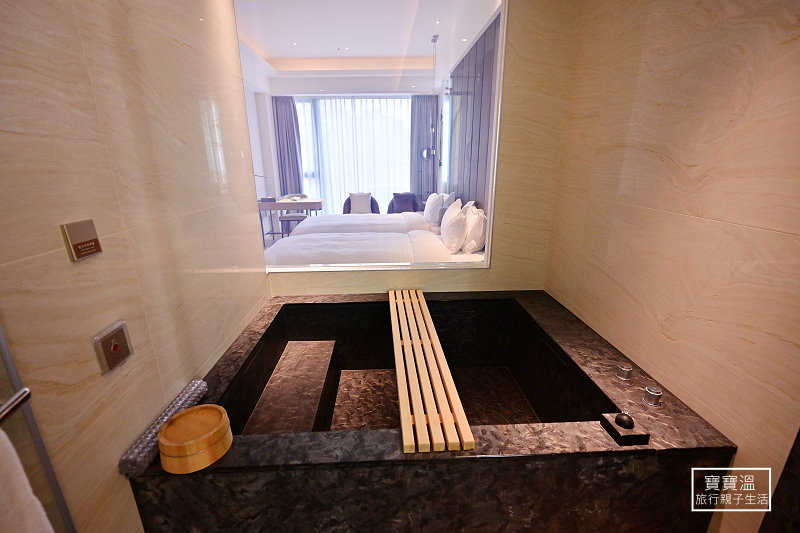
You are a GUI agent. You are given a task and a screenshot of the screen. Output one action in this format:
    pyautogui.click(x=<x>, y=<y>)
    Task: Click on the temperature control knobs
    The width and height of the screenshot is (800, 533).
    Given the screenshot: What is the action you would take?
    pyautogui.click(x=624, y=371), pyautogui.click(x=650, y=397)